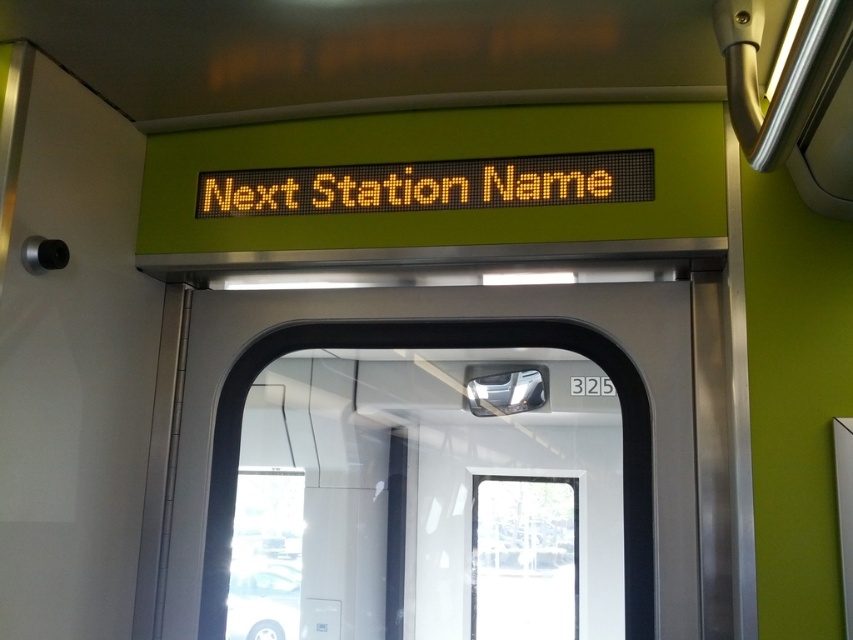
You are a passenger on the train and want to know if the point at coordinates (360, 307) is closer to the front of the train compared to the point at (408, 168). Based on their positions, which point is positioned further back in the train?

Point (360, 307) is behind point (408, 168), so it is positioned further back in the train.

You are a passenger on the train and want to exit at the next station. You notice the metallic silver door at center and the yellow led display at upper center. Which object is positioned lower in the train compartment?

The metallic silver door at center is located below the yellow led display at upper center, so the metallic silver door at center is positioned lower in the train compartment.